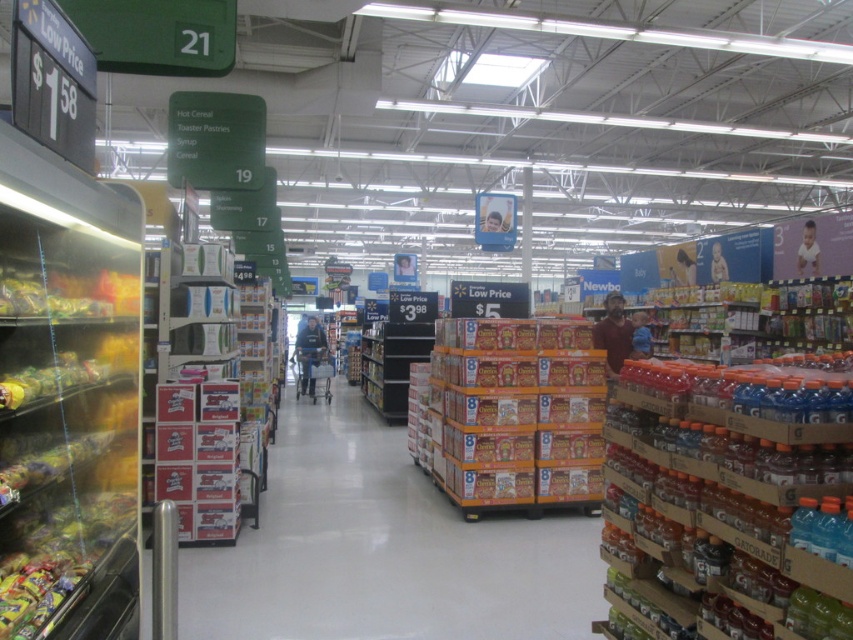
Is translucent plastic candy at left below yellow cardboard cereal boxes at center?

Incorrect, translucent plastic candy at left is not positioned below yellow cardboard cereal boxes at center.

How much distance is there between translucent plastic candy at left and yellow cardboard cereal boxes at center?

The distance of translucent plastic candy at left from yellow cardboard cereal boxes at center is 4.10 meters.

Is point (83, 472) positioned before point (581, 502)?

That is True.

At what (x,y) coordinates should I click in order to perform the action: click on translucent plastic candy at left. Please return your answer as a coordinate pair (x, y). Looking at the image, I should click on (67, 397).

Which is in front, point (109, 630) or point (683, 621)?

Point (109, 630) is in front.

Can you confirm if translucent plastic candy at left is thinner than translucent plastic bottles at right?

Yes.

The height and width of the screenshot is (640, 853). What do you see at coordinates (67, 397) in the screenshot?
I see `translucent plastic candy at left` at bounding box center [67, 397].

Identify the location of translucent plastic candy at left. This screenshot has width=853, height=640. (67, 397).

Is translucent plastic candy at left thinner than orange cardboard boxes at center?

Yes, translucent plastic candy at left is thinner than orange cardboard boxes at center.

Is point (57, 621) farther from camera compared to point (552, 636)?

No, it is not.

Is point (131, 321) more distant than point (329, 515)?

No, it is in front of (329, 515).

At what (x,y) coordinates should I click in order to perform the action: click on translucent plastic candy at left. Please return your answer as a coordinate pair (x, y). This screenshot has height=640, width=853. Looking at the image, I should click on coord(67,397).